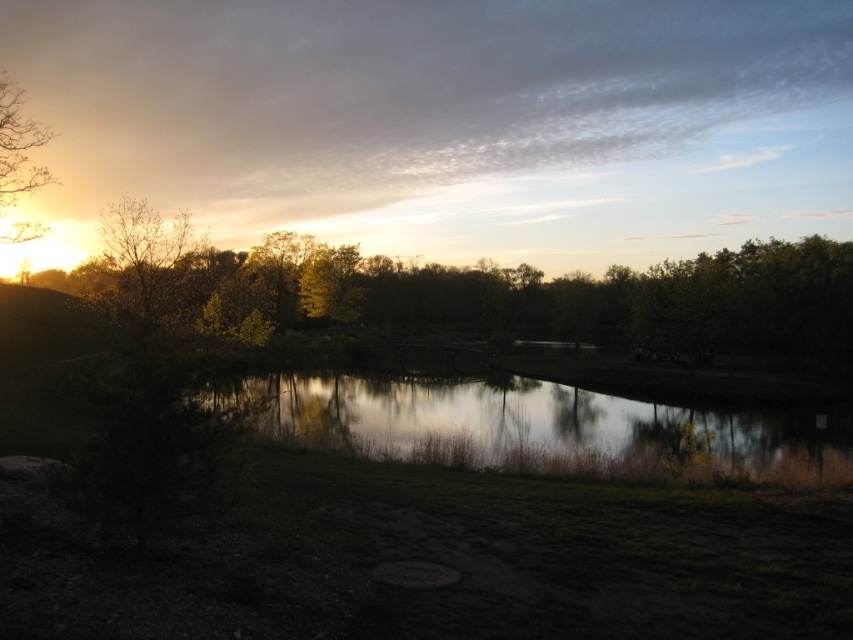
Between point (136, 205) and point (9, 177), which one is positioned in front?

Positioned in front is point (9, 177).

Who is higher up, bare branches at left or brown leafy tree at upper left?

brown leafy tree at upper left is higher up.

Is point (117, 257) positioned behind point (4, 147)?

No, (117, 257) is closer to viewer.

Identify the location of bare branches at left. Image resolution: width=853 pixels, height=640 pixels. (148, 260).

In the scene shown: Which of these two, reflective glass water at center or brown leafy tree at upper left, stands taller?

brown leafy tree at upper left

Looking at this image, does reflective glass water at center have a lesser height compared to brown leafy tree at upper left?

Yes.

Between point (310, 419) and point (15, 86), which one is positioned behind?

Point (15, 86)

Where is `reflective glass water at center`? The width and height of the screenshot is (853, 640). reflective glass water at center is located at coordinates (540, 428).

Can you confirm if reflective glass water at center is smaller than bare branches at left?

Yes.

Does point (524, 396) lie in front of point (167, 232)?

No, it is not.

Describe the element at coordinates (540, 428) in the screenshot. The height and width of the screenshot is (640, 853). I see `reflective glass water at center` at that location.

The height and width of the screenshot is (640, 853). Find the location of `reflective glass water at center`. reflective glass water at center is located at coordinates (540, 428).